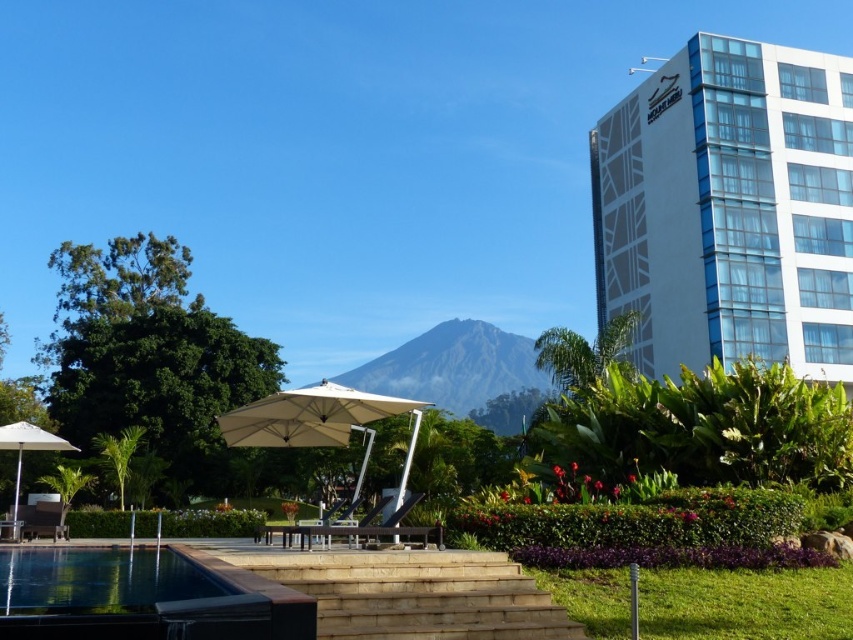
You are planning to take a photo of the white glass building at upper right and the beige fabric umbrella at center from the poolside. Which object should you aim your camera upwards to capture?

You should aim your camera upwards to capture the white glass building at upper right because it is positioned above the beige fabric umbrella at center.

You are standing at the edge of the pool and want to take a photo of the white glass building at upper right. If your camera has a maximum zoom range of 100 feet, will you need to zoom in to capture the building clearly?

The white glass building at upper right is 106.58 feet away from the camera. Since the camera can only zoom up to 100 feet, you will need to zoom in beyond its maximum range to capture the building clearly.